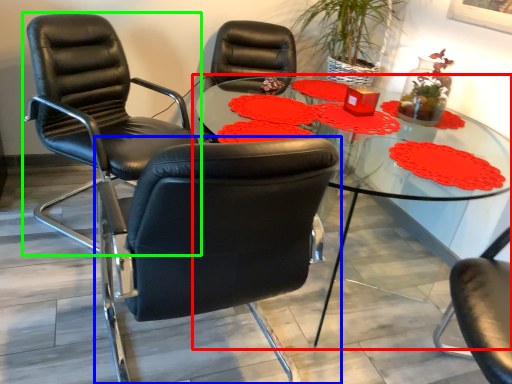
Question: Considering the real-world distances, which object is farthest from table (highlighted by a red box)? chair (highlighted by a blue box) or chair (highlighted by a green box)?

Choices:
 (A) chair
 (B) chair

Answer: (B)